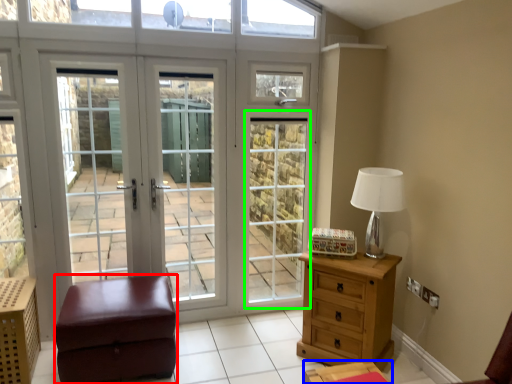
Question: Which object is positioned farthest from furniture (highlighted by a red box)? Select from nightstand (highlighted by a blue box) and screen door (highlighted by a green box).

Choices:
 (A) nightstand
 (B) screen door

Answer: (B)